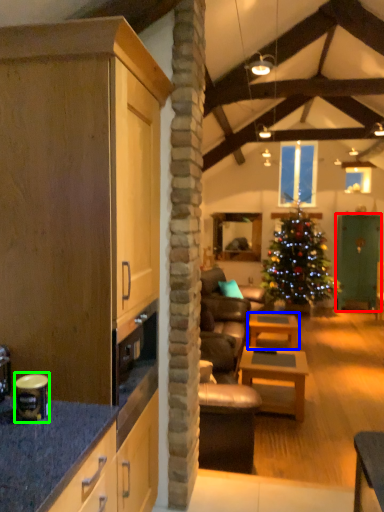
Question: Based on their relative distances, which object is farther from glass door (highlighted by a red box)? Choose from table (highlighted by a blue box) and appliance (highlighted by a green box).

Choices:
 (A) table
 (B) appliance

Answer: (B)